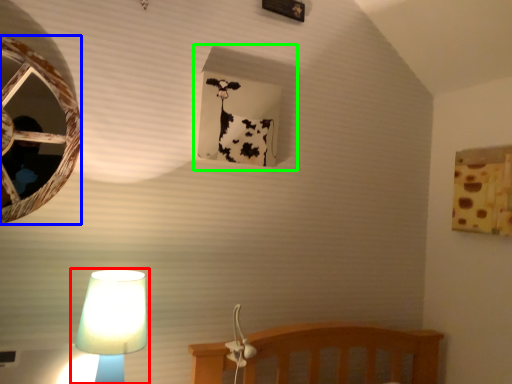
Question: Which is farther away from lamp (highlighted by a red box)? oval (highlighted by a blue box) or window frame (highlighted by a green box)?

Choices:
 (A) oval
 (B) window frame

Answer: (B)